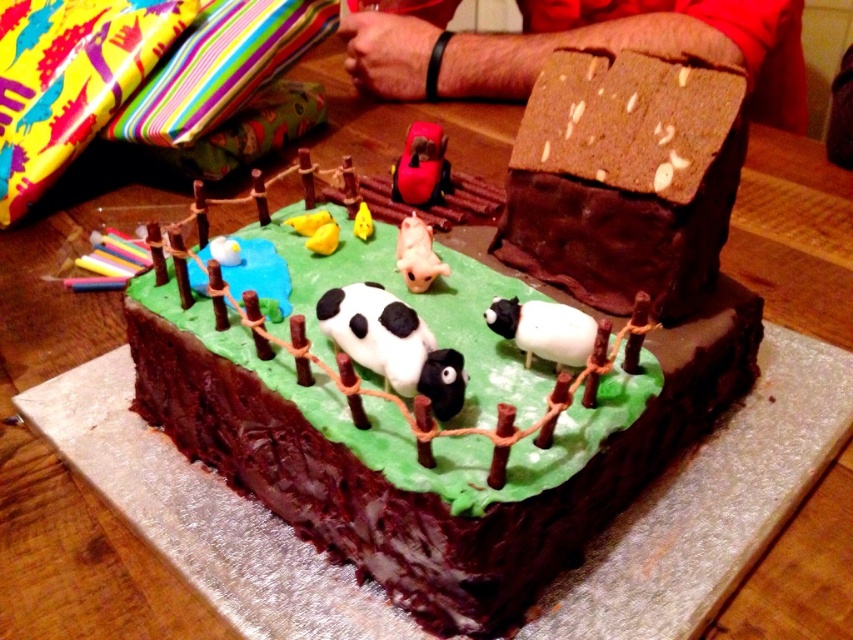
Looking at this image, you are a guest at a birthday party and want to take a photo of the farm cake. The photographer asks you to stand at a position where you can see both the barn and the cow. The barn is located at point [514,204] and the cow is at point [363,305]. Based on their positions, which object should be closer to you so that you can see both in the frame?

Point [363,305] is closer to you than point [514,204]. Therefore, the cow at point [363,305] should be closer to ensure both the barn and the cow are visible in the photo.

You are a baker trying to determine the arrangement of the cake components. Based on the image, which object is wider, the chocolate cake at center or the chocolatealmondhouse at upper center?

The chocolate cake at center is wider than the chocolatealmondhouse at upper center according to the description.